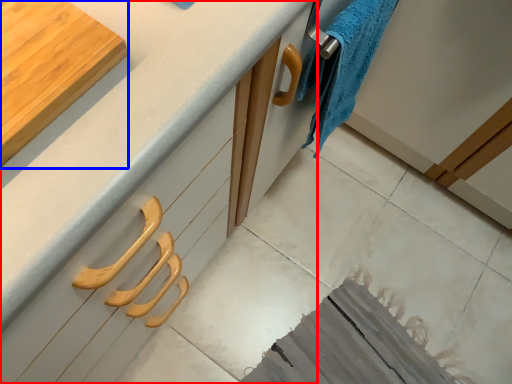
Question: Which object appears farthest to the camera in this image, countertop (highlighted by a red box) or cutting board (highlighted by a blue box)?

Choices:
 (A) countertop
 (B) cutting board

Answer: (B)